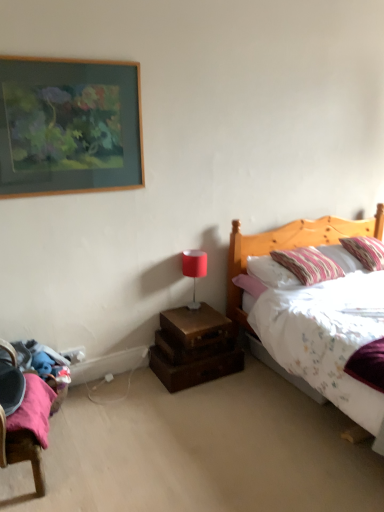
Locate an element on the screen. striped fabric pillow at upper right, the second pillow viewed from the left is located at coordinates (366, 251).

This screenshot has height=512, width=384. What are the coordinates of `wooden picture frame at upper left` in the screenshot? It's located at (69, 126).

Is striped fabric pillow at upper right, the second pillow viewed from the left, aimed at wooden picture frame at upper left?

No, striped fabric pillow at upper right, the second pillow viewed from the left, is not aimed at wooden picture frame at upper left.

Which object is positioned more to the left, striped fabric pillow at upper right, the second pillow viewed from the left, or wooden picture frame at upper left?

wooden picture frame at upper left.

Is point (369, 240) closer to viewer compared to point (68, 145)?

No, it is not.

Considering the sizes of objects striped fabric pillow at upper right, the second pillow viewed from the left, and wooden picture frame at upper left in the image provided, who is shorter, striped fabric pillow at upper right, the second pillow viewed from the left, or wooden picture frame at upper left?

striped fabric pillow at upper right, the second pillow viewed from the left.

Looking at this image, is matte red lamp at center at the right side of striped fabric pillow at upper right, which ranks as the 1th pillow in right-to-left order?

In fact, matte red lamp at center is to the left of striped fabric pillow at upper right, which ranks as the 1th pillow in right-to-left order.

Which object is wider, matte red lamp at center or striped fabric pillow at upper right, the second pillow viewed from the left?

striped fabric pillow at upper right, the second pillow viewed from the left.

From a real-world perspective, is matte red lamp at center positioned under striped fabric pillow at upper right, the second pillow viewed from the left, based on gravity?

Yes, from a real-world perspective, matte red lamp at center is below striped fabric pillow at upper right, the second pillow viewed from the left.

Can you confirm if matte red lamp at center is smaller than striped fabric pillow at upper right, which ranks as the 1th pillow in right-to-left order?

Yes.

Which of these two, wooden trunk at lower center or wooden nightstand at lower center, is smaller?

wooden trunk at lower center.

Does wooden trunk at lower center turn towards wooden nightstand at lower center?

No, wooden trunk at lower center does not turn towards wooden nightstand at lower center.

Is wooden trunk at lower center in contact with wooden nightstand at lower center?

Yes, wooden trunk at lower center is in contact with wooden nightstand at lower center.

Does matte red lamp at center appear on the right side of wooden nightstand at lower center?

No, matte red lamp at center is not to the right of wooden nightstand at lower center.

Based on the photo, from a real-world perspective, is matte red lamp at center positioned under wooden nightstand at lower center based on gravity?

Actually, matte red lamp at center is physically above wooden nightstand at lower center in the real world.

Between matte red lamp at center and wooden nightstand at lower center, which one has larger size?

wooden nightstand at lower center is bigger.

Measure the distance from matte red lamp at center to wooden nightstand at lower center.

matte red lamp at center is 14.92 inches away from wooden nightstand at lower center.

Can you confirm if wooden nightstand at lower center is wider than wooden picture frame at upper left?

Indeed, wooden nightstand at lower center has a greater width compared to wooden picture frame at upper left.

From a real-world perspective, who is located higher, wooden nightstand at lower center or wooden picture frame at upper left?

In real-world perspective, wooden picture frame at upper left is above.

Could you tell me if wooden nightstand at lower center is facing wooden picture frame at upper left?

No, wooden nightstand at lower center is not oriented towards wooden picture frame at upper left.

From the image's perspective, between wooden picture frame at upper left and wooden trunk at lower center, who is located below?

wooden trunk at lower center appears lower in the image.

Is there a large distance between wooden picture frame at upper left and wooden trunk at lower center?

That's right, there is a large distance between wooden picture frame at upper left and wooden trunk at lower center.

Is point (133, 159) closer or farther from the camera than point (203, 316)?

Point (133, 159) appears to be closer to the viewer than point (203, 316).

Is wooden picture frame at upper left oriented away from wooden trunk at lower center?

No, wooden picture frame at upper left is not facing the opposite direction of wooden trunk at lower center.

Is wooden picture frame at upper left turned away from striped fabric pillow at upper right, the 2th pillow when ordered from right to left?

No, striped fabric pillow at upper right, the 2th pillow when ordered from right to left, is not at the back of wooden picture frame at upper left.

Which point is more forward, (52, 138) or (279, 258)?

The point (52, 138) is in front.

Between wooden picture frame at upper left and striped fabric pillow at upper right, the 2th pillow when ordered from right to left, which one has less height?

striped fabric pillow at upper right, the 2th pillow when ordered from right to left, is shorter.

Find the location of a particular element. This screenshot has width=384, height=512. picture frame located above the striped fabric pillow at upper right, the second pillow viewed from the left (from the image's perspective) is located at coordinates (69, 126).

You are a GUI agent. You are given a task and a screenshot of the screen. Output one action in this format:
    pyautogui.click(x=<x>, y=<y>)
    Task: Click on the table lamp below the striped fabric pillow at upper right, the second pillow viewed from the left (from a real-world perspective)
    
    Given the screenshot: What is the action you would take?
    pyautogui.click(x=194, y=270)

Based on their spatial positions, is matte red lamp at center or wooden trunk at lower center further from striped fabric pillow at upper right, which ranks as the 1th pillow in right-to-left order?

wooden trunk at lower center.

Which object lies further to the anchor point striped fabric pillow at upper right, which is the first pillow from left to right, striped fabric pillow at upper right, which ranks as the 1th pillow in right-to-left order, or wooden picture frame at upper left?

Based on the image, wooden picture frame at upper left appears to be further to striped fabric pillow at upper right, which is the first pillow from left to right.

Considering their positions, is striped fabric pillow at upper right, the 2th pillow when ordered from right to left, positioned closer to striped fabric pillow at upper right, the second pillow viewed from the left, than wooden picture frame at upper left?

striped fabric pillow at upper right, the 2th pillow when ordered from right to left, is positioned closer to the anchor striped fabric pillow at upper right, the second pillow viewed from the left.

Considering their positions, is striped fabric pillow at upper right, which is the first pillow from left to right, positioned further to wooden trunk at lower center than wooden nightstand at lower center?

The object further to wooden trunk at lower center is striped fabric pillow at upper right, which is the first pillow from left to right.

Looking at the image, which one is located closer to striped fabric pillow at upper right, the 2th pillow when ordered from right to left, striped fabric pillow at upper right, which ranks as the 1th pillow in right-to-left order, or wooden trunk at lower center?

Based on the image, striped fabric pillow at upper right, which ranks as the 1th pillow in right-to-left order, appears to be nearer to striped fabric pillow at upper right, the 2th pillow when ordered from right to left.

Estimate the real-world distances between objects in this image. Which object is further from wooden trunk at lower center, wooden picture frame at upper left or wooden nightstand at lower center?

Based on the image, wooden picture frame at upper left appears to be further to wooden trunk at lower center.

Considering their positions, is wooden nightstand at lower center positioned further to wooden trunk at lower center than striped fabric pillow at upper right, which ranks as the 1th pillow in right-to-left order?

Among the two, striped fabric pillow at upper right, which ranks as the 1th pillow in right-to-left order, is located further to wooden trunk at lower center.

Looking at the image, which one is located closer to wooden trunk at lower center, striped fabric pillow at upper right, which is the first pillow from left to right, or wooden picture frame at upper left?

striped fabric pillow at upper right, which is the first pillow from left to right.

This screenshot has height=512, width=384. What are the coordinates of `table between matte red lamp at center and striped fabric pillow at upper right, which ranks as the 1th pillow in right-to-left order` in the screenshot? It's located at (196, 326).

I want to click on pillow between matte red lamp at center and striped fabric pillow at upper right, which ranks as the 1th pillow in right-to-left order, from left to right, so click(x=308, y=265).

Where is `table lamp between wooden picture frame at upper left and wooden trunk at lower center in the vertical direction`? This screenshot has width=384, height=512. table lamp between wooden picture frame at upper left and wooden trunk at lower center in the vertical direction is located at coordinates (194, 270).

Image resolution: width=384 pixels, height=512 pixels. In order to click on table between wooden picture frame at upper left and wooden nightstand at lower center in the up-down direction in this screenshot , I will do `click(196, 326)`.